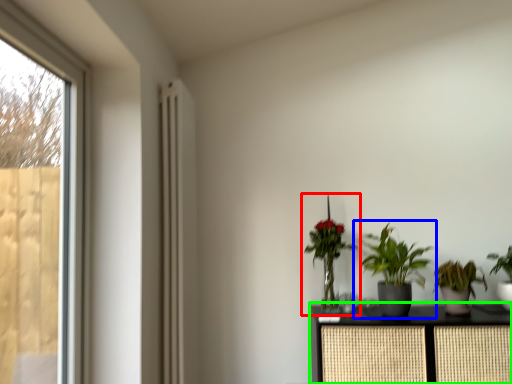
Question: Which is nearer to the houseplant (highlighted by a red box)? houseplant (highlighted by a blue box) or furniture (highlighted by a green box).

Choices:
 (A) houseplant
 (B) furniture

Answer: (A)